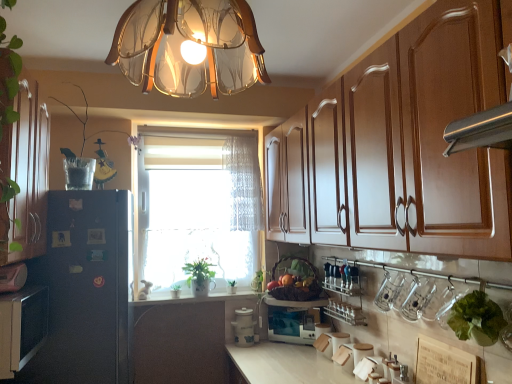
Question: Which direction should I rotate to look at green leafy plant at window, which is counted as the 2th plant, starting from the bottom, — up or down?

Choices:
 (A) down
 (B) up

Answer: (A)

Question: Would you say translucent glass chandelier at upper center is a long distance from metallic silver spice rack at lower center?

Choices:
 (A) yes
 (B) no

Answer: (A)

Question: Would you say metallic silver spice rack at lower center is part of translucent glass chandelier at upper center's contents?

Choices:
 (A) no
 (B) yes

Answer: (A)

Question: From the image's perspective, is translucent glass chandelier at upper center above metallic silver spice rack at lower center?

Choices:
 (A) yes
 (B) no

Answer: (A)

Question: Is translucent glass chandelier at upper center at the right side of metallic silver spice rack at lower center?

Choices:
 (A) yes
 (B) no

Answer: (B)

Question: Does translucent glass chandelier at upper center appear on the left side of metallic silver spice rack at lower center?

Choices:
 (A) no
 (B) yes

Answer: (B)

Question: Does translucent glass chandelier at upper center have a lesser height compared to metallic silver spice rack at lower center?

Choices:
 (A) no
 (B) yes

Answer: (A)

Question: Does metallic silver spice rack at lower center appear on the right side of matte black microwave at center, which is the first appliance from right to left?

Choices:
 (A) yes
 (B) no

Answer: (A)

Question: Does metallic silver spice rack at lower center have a larger size compared to matte black microwave at center, which is the first appliance from right to left?

Choices:
 (A) no
 (B) yes

Answer: (B)

Question: Considering the relative sizes of metallic silver spice rack at lower center and matte black microwave at center, the second appliance in the left-to-right sequence, in the image provided, is metallic silver spice rack at lower center taller than matte black microwave at center, the second appliance in the left-to-right sequence,?

Choices:
 (A) yes
 (B) no

Answer: (A)

Question: Considering the relative sizes of metallic silver spice rack at lower center and matte black microwave at center, which is the first appliance from right to left, in the image provided, is metallic silver spice rack at lower center smaller than matte black microwave at center, which is the first appliance from right to left,?

Choices:
 (A) yes
 (B) no

Answer: (B)

Question: Does metallic silver spice rack at lower center have a lesser height compared to matte black microwave at center, the second appliance in the left-to-right sequence?

Choices:
 (A) yes
 (B) no

Answer: (B)

Question: Is metallic silver spice rack at lower center next to matte black microwave at center, which is the first appliance from right to left, and touching it?

Choices:
 (A) no
 (B) yes

Answer: (A)

Question: Is green leafy plant at window, which is the second plant in back-to-front order, oriented towards matte black microwave at center, which is the first appliance from right to left?

Choices:
 (A) yes
 (B) no

Answer: (B)